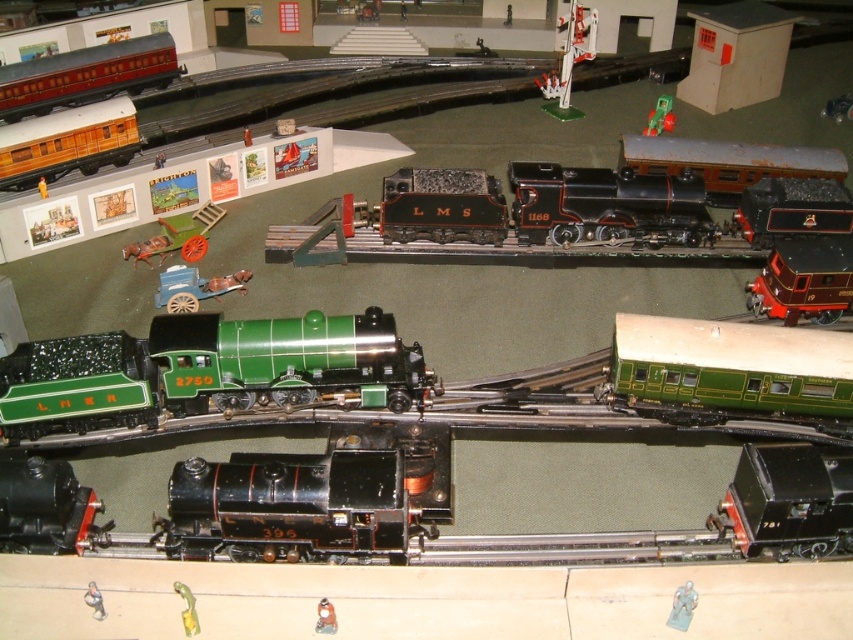
Based on the photo, you are a toy collector who wants to place a new metallic silver toy at lower left closer to the green polished metal locomotive at center. The minimum distance required between the two toys is 30 centimeters for safety. Is the current distance sufficient?

The green polished metal locomotive at center is 41.57 centimeters from the metallic silver toy at lower left, which exceeds the minimum required 30 centimeters, so the current distance is sufficient.

You are a model train enthusiast who wants to place a new toy on the display shelf. You have a small metallic silver toy that is 3 inches tall. The display shelf has a height restriction of 4 inches. Can the green polished metal locomotive at center be placed on the shelf along with the metallic silver toy at lower left?

The green polished metal locomotive at center is taller than the metallic silver toy at lower left. Since the shelf has a 4 inch height limit and the green locomotive is taller than the silver toy, we need to check if the green locomotive is under 4 inches. However, since the silver toy is 3 inches and the green one is taller, it might exceed the limit. Without exact measurements, we can infer the green locomotive may not fit, so it cannot be placed on the shelf along with the metallic silver toy at lower.

You are a model train enthusiast examining the diorama. You notice the green polished metal locomotive at center and the metallic silver toy at lower left. Which object is positioned higher in the scene?

The green polished metal locomotive at center is above the metallic silver toy at lower left, so it is positioned higher in the scene.